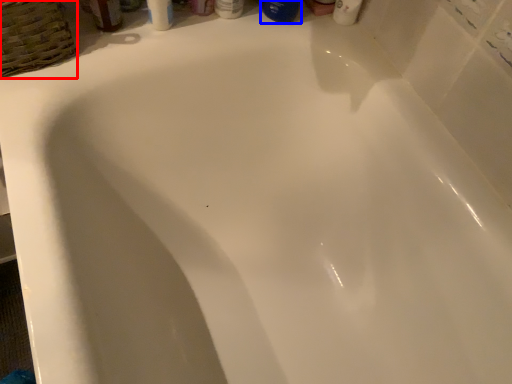
Question: Which point is further to the camera, basket (highlighted by a red box) or mouthwash (highlighted by a blue box)?

Choices:
 (A) basket
 (B) mouthwash

Answer: (B)